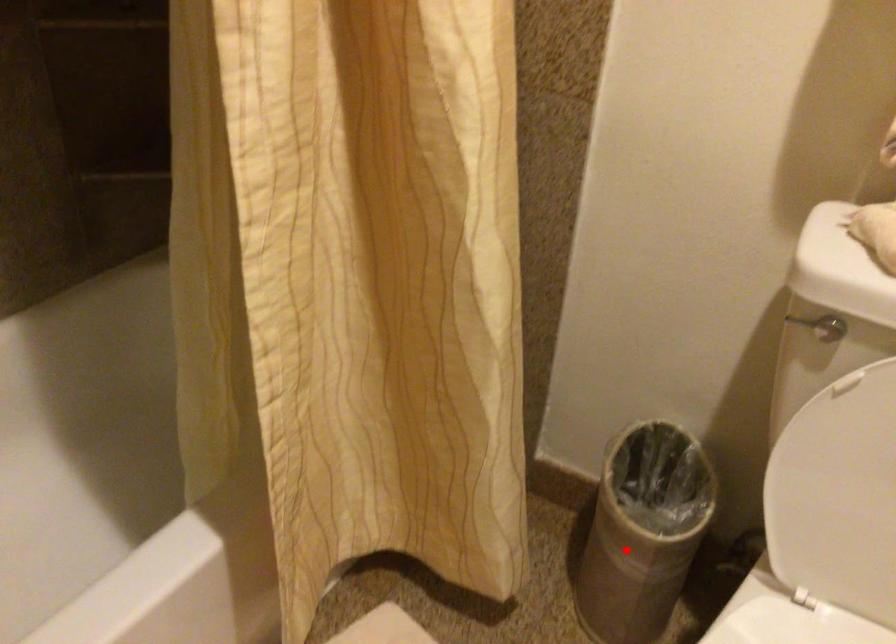
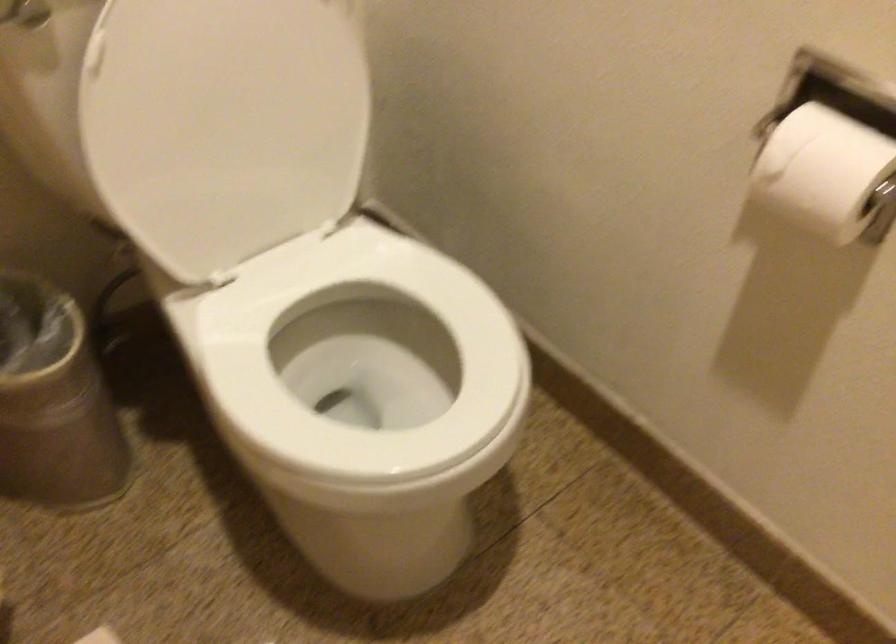
Question: I am providing you with two images of the same scene from different viewpoints. Given a red point in image1, look at the same physical point in image2. Is it:

Choices:
 (A) Closer to the viewpoint
 (B) Farther from the viewpoint

Answer: (A)